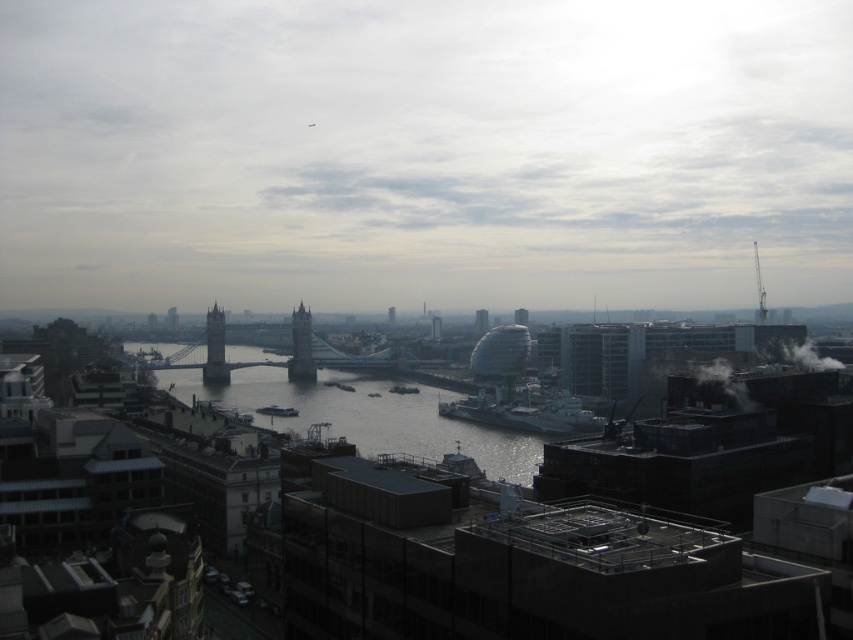
Can you confirm if dark gray concrete river at center is shorter than dark gray stone tower at center?

Correct, dark gray concrete river at center is not as tall as dark gray stone tower at center.

Can you confirm if dark gray concrete river at center is positioned below dark gray stone tower at center?

Yes.

Who is more forward, (271, 374) or (312, 380)?

Point (312, 380) is more forward.

You are a GUI agent. You are given a task and a screenshot of the screen. Output one action in this format:
    pyautogui.click(x=<x>, y=<y>)
    Task: Click on the dark gray concrete river at center
    This screenshot has width=853, height=640.
    Given the screenshot: What is the action you would take?
    pyautogui.click(x=368, y=416)

Can you confirm if dark gray stone tower at center is shorter than dark gray stone tower bridge at center-left?

Yes.

Between dark gray stone tower at center and dark gray stone tower bridge at center-left, which one has more height?

With more height is dark gray stone tower bridge at center-left.

Where is `dark gray stone tower at center`? The image size is (853, 640). dark gray stone tower at center is located at coordinates (300, 348).

Image resolution: width=853 pixels, height=640 pixels. In order to click on dark gray stone tower at center in this screenshot , I will do `click(300, 348)`.

Is dark gray concrete river at center bigger than dark gray stone tower bridge at center-left?

Correct, dark gray concrete river at center is larger in size than dark gray stone tower bridge at center-left.

Image resolution: width=853 pixels, height=640 pixels. Identify the location of dark gray concrete river at center. (368, 416).

I want to click on dark gray concrete river at center, so click(x=368, y=416).